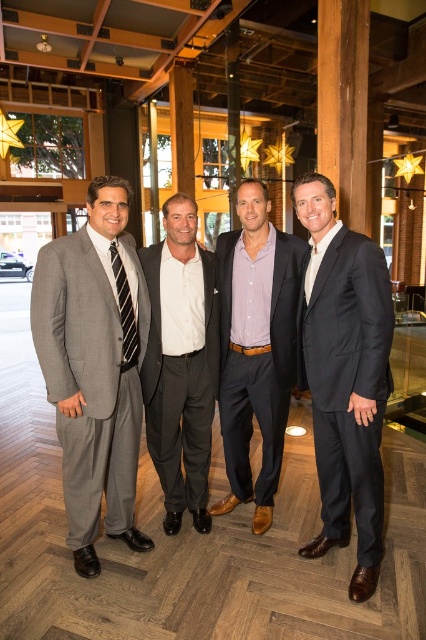
Question: Is gray wool suit at left to the left of dark blue suit at right from the viewer's perspective?

Choices:
 (A) yes
 (B) no

Answer: (A)

Question: Which is nearer to the white cotton shirt at center?

Choices:
 (A) striped fabric tie at left
 (B) gray wool suit at left
 (C) dark blue suit at right

Answer: (B)

Question: Is dark blue suit at right above purple cotton shirt at center?

Choices:
 (A) yes
 (B) no

Answer: (B)

Question: Which object appears farthest from the camera in this image?

Choices:
 (A) white cotton shirt at center
 (B) purple cotton shirt at center

Answer: (A)

Question: Based on their relative distances, which object is farther from the dark blue suit at right?

Choices:
 (A) striped fabric tie at left
 (B) gray wool suit at left

Answer: (A)

Question: Where is dark blue suit at right located in relation to black silk tie at right in the image?

Choices:
 (A) left
 (B) right

Answer: (B)